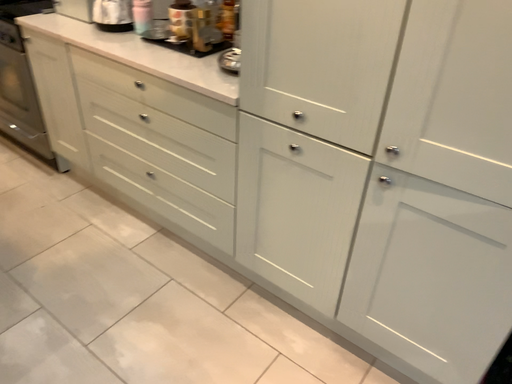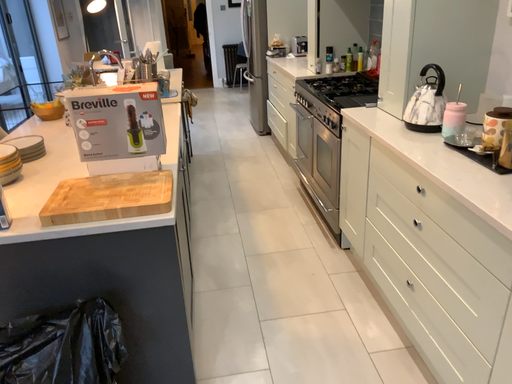
Question: How did the camera likely rotate when shooting the video?

Choices:
 (A) rotated right
 (B) rotated left

Answer: (B)